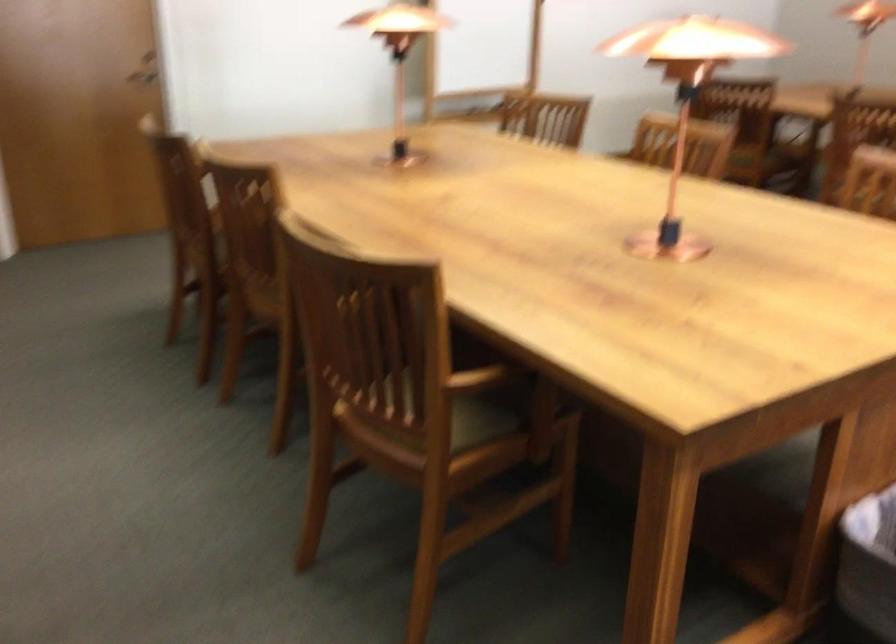
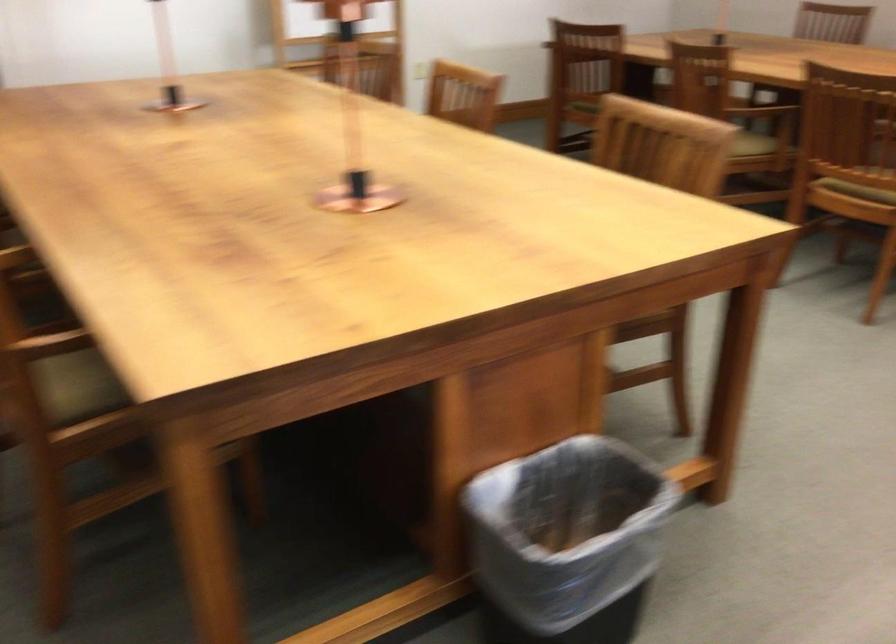
Question: What movement of the cameraman would produce the second image?

Choices:
 (A) Left
 (B) Right
 (C) Forward
 (D) Backward

Answer: (B)